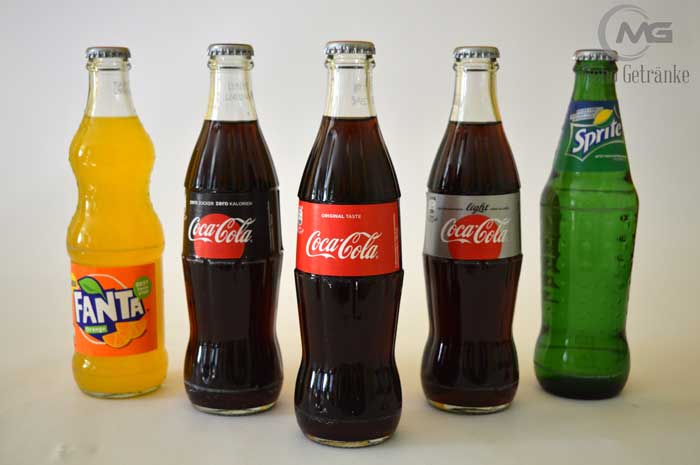
Locate an element on the screen. bottles is located at coordinates (578, 316), (454, 372), (341, 406), (229, 365), (119, 352).